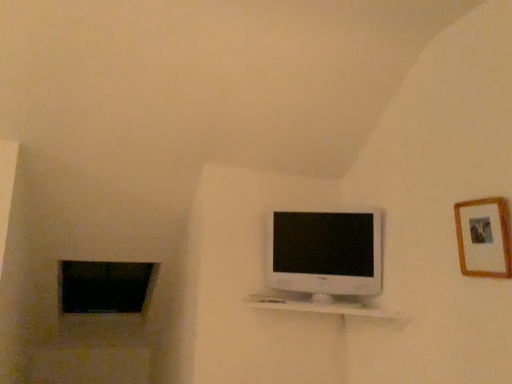
Question: Is wooden picture frame at upper right behind white glossy shelf at center?

Choices:
 (A) yes
 (B) no

Answer: (B)

Question: Can you confirm if wooden picture frame at upper right is wider than white glossy shelf at center?

Choices:
 (A) yes
 (B) no

Answer: (B)

Question: Is white glossy shelf at center a part of wooden picture frame at upper right?

Choices:
 (A) no
 (B) yes

Answer: (A)

Question: Could you tell me if wooden picture frame at upper right is facing white glossy shelf at center?

Choices:
 (A) yes
 (B) no

Answer: (B)

Question: Does wooden picture frame at upper right have a lesser height compared to white glossy shelf at center?

Choices:
 (A) yes
 (B) no

Answer: (B)

Question: Does wooden picture frame at upper right have a lesser width compared to white glossy shelf at center?

Choices:
 (A) no
 (B) yes

Answer: (B)

Question: Is white glossy shelf at center at the right side of black glass window at lower left?

Choices:
 (A) no
 (B) yes

Answer: (B)

Question: Are white glossy shelf at center and black glass window at lower left making contact?

Choices:
 (A) yes
 (B) no

Answer: (B)

Question: Considering the relative sizes of white glossy shelf at center and black glass window at lower left in the image provided, is white glossy shelf at center smaller than black glass window at lower left?

Choices:
 (A) yes
 (B) no

Answer: (A)

Question: Is white glossy shelf at center not within black glass window at lower left?

Choices:
 (A) yes
 (B) no

Answer: (A)

Question: Is white glossy shelf at center aimed at black glass window at lower left?

Choices:
 (A) no
 (B) yes

Answer: (A)

Question: Is white glossy shelf at center closer to the viewer compared to black glass window at lower left?

Choices:
 (A) no
 (B) yes

Answer: (B)

Question: Can you confirm if black glass window at lower left is shorter than white glossy shelf at center?

Choices:
 (A) yes
 (B) no

Answer: (B)